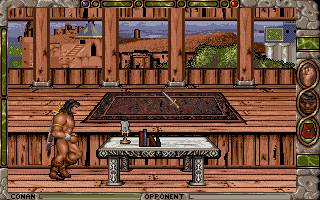
Where is `candle`? candle is located at coordinates (125, 127).